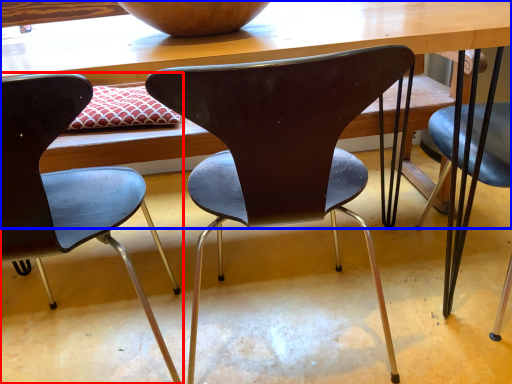
Question: Among these objects, which one is nearest to the camera, chair (highlighted by a red box) or table (highlighted by a blue box)?

Choices:
 (A) chair
 (B) table

Answer: (A)